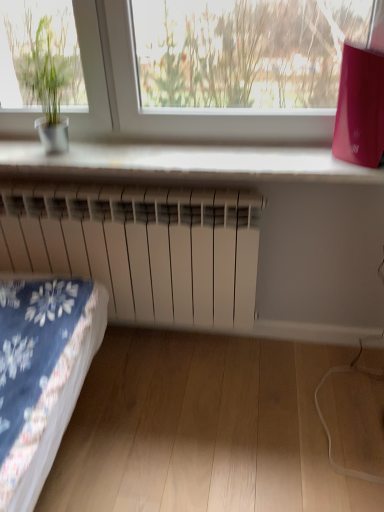
Identify the location of empty space that is ontop of white plastic radiator at lower center (from a real-world perspective). (164, 152).